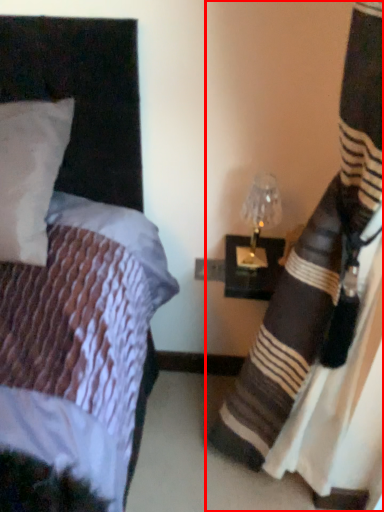
Question: From the image's perspective, considering the relative positions of curtain (annotated by the red box) and bedside lamp in the image provided, where is curtain (annotated by the red box) located with respect to the staircase?

Choices:
 (A) below
 (B) above

Answer: (A)